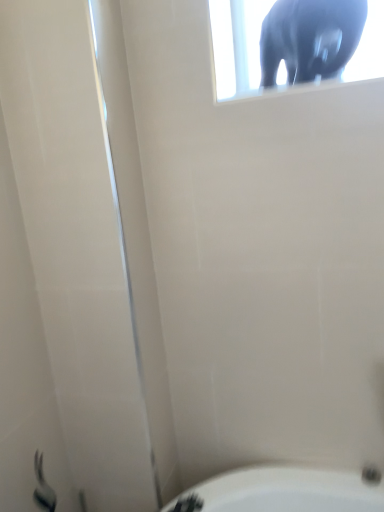
Question: Should I look upward or downward to see matte gray elephant at upper center?

Choices:
 (A) up
 (B) down

Answer: (A)